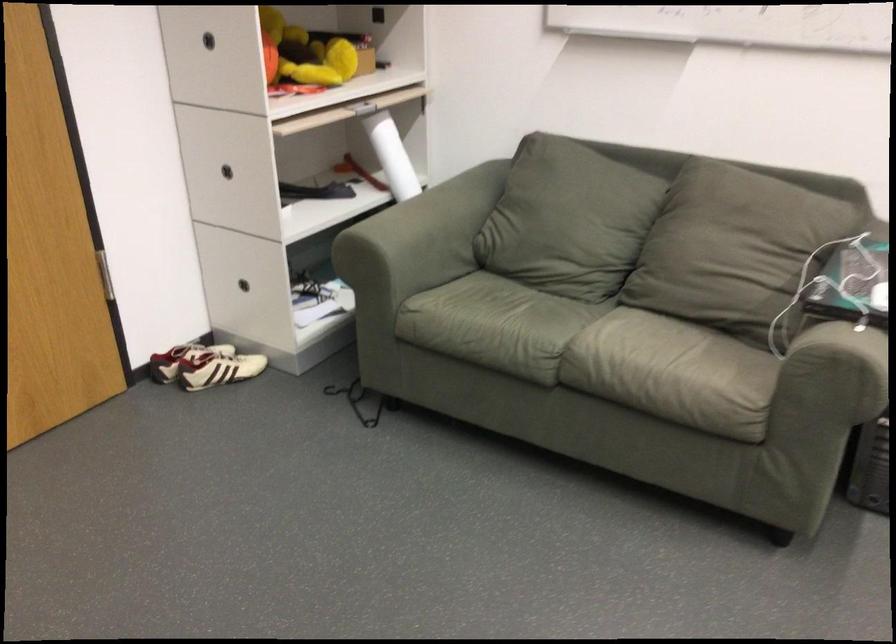
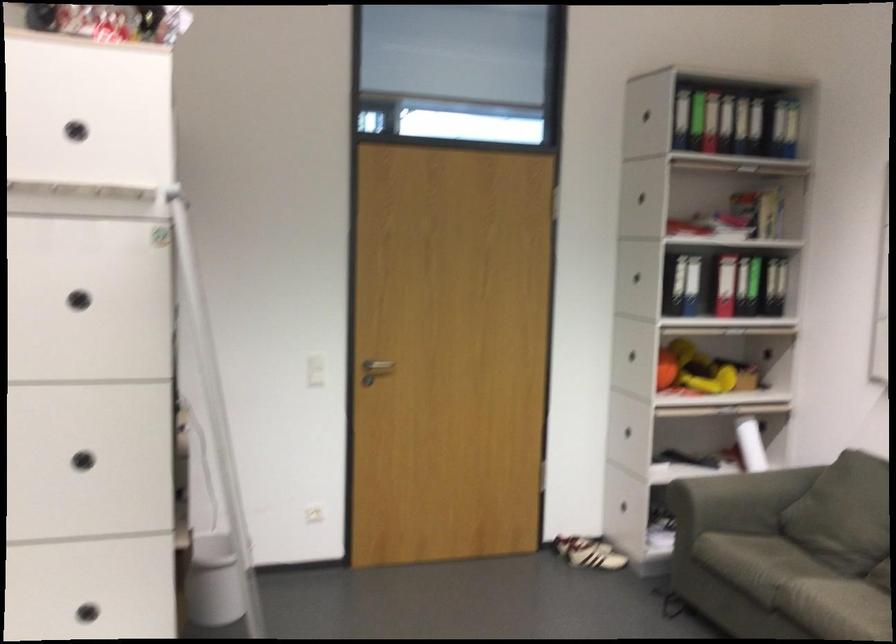
The point at (514, 286) is marked in the first image. Where is the corresponding point in the second image?

(787, 550)